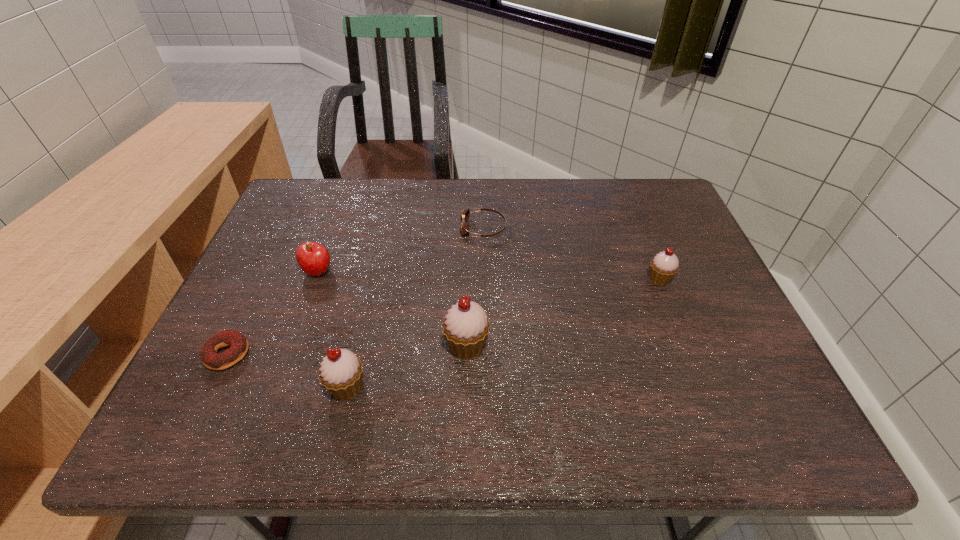
You are a GUI agent. You are given a task and a screenshot of the screen. Output one action in this format:
    pyautogui.click(x=<x>, y=<y>)
    Task: Click on the leftmost cupcake
    The image size is (960, 540).
    Given the screenshot: What is the action you would take?
    pyautogui.click(x=341, y=374)

You are a GUI agent. You are given a task and a screenshot of the screen. Output one action in this format:
    pyautogui.click(x=<x>, y=<y>)
    Task: Click on the fifth shortest object
    The image size is (960, 540).
    Given the screenshot: What is the action you would take?
    pyautogui.click(x=341, y=374)

The height and width of the screenshot is (540, 960). In order to click on the tallest cupcake in this screenshot , I will do `click(465, 328)`.

The width and height of the screenshot is (960, 540). Identify the location of the second cupcake from right to left. (465, 328).

Find the location of a particular element. the rightmost object is located at coordinates (664, 266).

The image size is (960, 540). Identify the location of the shortest cupcake. (664, 266).

You are a GUI agent. You are given a task and a screenshot of the screen. Output one action in this format:
    pyautogui.click(x=<x>, y=<y>)
    Task: Click on the fifth object from right to left
    Image resolution: width=960 pixels, height=540 pixels.
    Given the screenshot: What is the action you would take?
    pyautogui.click(x=313, y=258)

Locate an element on the screen. the farthest object is located at coordinates (464, 230).

Find the location of a particular element. the leftmost object is located at coordinates (238, 343).

The width and height of the screenshot is (960, 540). I want to click on free space located on the right of the fourth object from right to left, so click(438, 387).